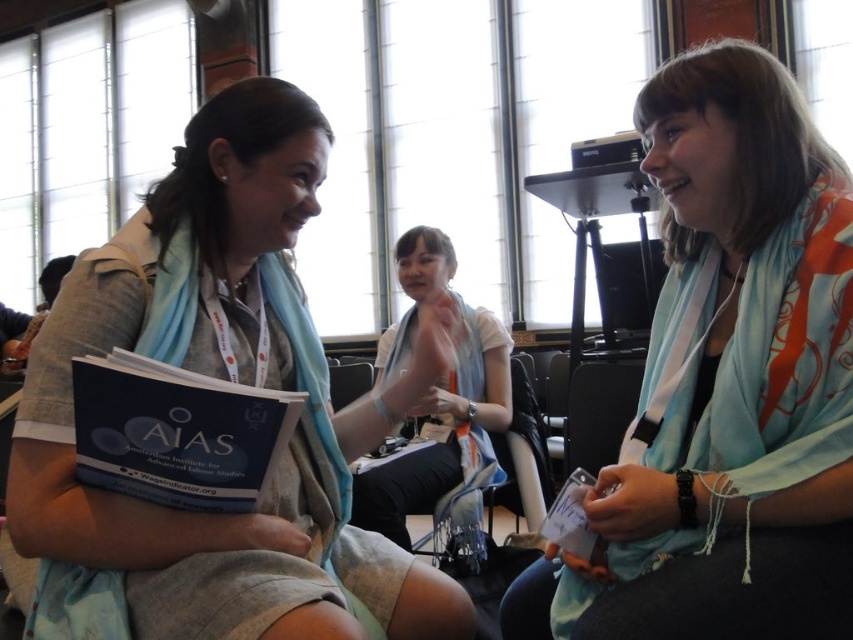
Where is `light blue scarf at center`? light blue scarf at center is located at coordinates (726, 384).

Is point (773, 598) farther from viewer compared to point (384, 467)?

That is False.

At what (x,y) coordinates should I click in order to perform the action: click on light blue scarf at center. Please return your answer as a coordinate pair (x, y). Looking at the image, I should click on (726, 384).

Between light blue scarf at center and blue matte book at center, which one appears on the left side from the viewer's perspective?

blue matte book at center is more to the left.

Find the location of a particular element. Image resolution: width=853 pixels, height=640 pixels. light blue scarf at center is located at coordinates (726, 384).

Does light blue scarf at center have a lesser height compared to matte blue scarf at left?

No.

Who is higher up, light blue scarf at center or matte blue scarf at left?

Positioned higher is light blue scarf at center.

Is point (735, 406) positioned after point (267, 248)?

That is False.

The width and height of the screenshot is (853, 640). Identify the location of light blue scarf at center. (726, 384).